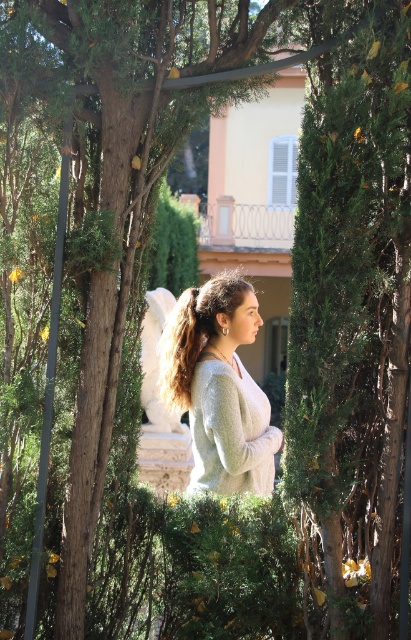
Who is taller, light gray sweater at center or light gray knitted sweater at center?

light gray sweater at center is taller.

Which is behind, point (219, 342) or point (207, 490)?

The point (219, 342) is behind.

This screenshot has height=640, width=411. I want to click on light gray sweater at center, so click(x=219, y=387).